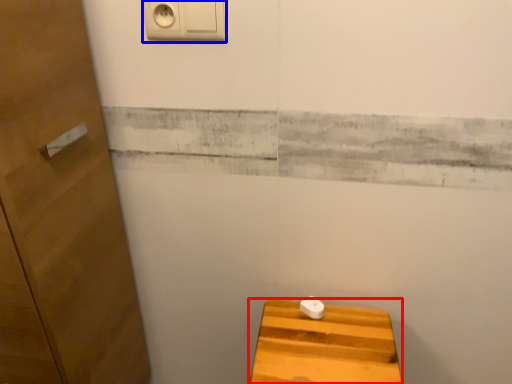
Question: Which object appears closest to the camera in this image, furniture (highlighted by a red box) or light switch (highlighted by a blue box)?

Choices:
 (A) furniture
 (B) light switch

Answer: (B)